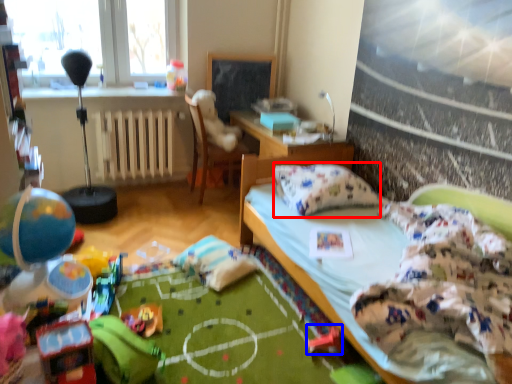
Question: Which object is closer to the camera taking this photo, pillow (highlighted by a red box) or toy (highlighted by a blue box)?

Choices:
 (A) pillow
 (B) toy

Answer: (B)